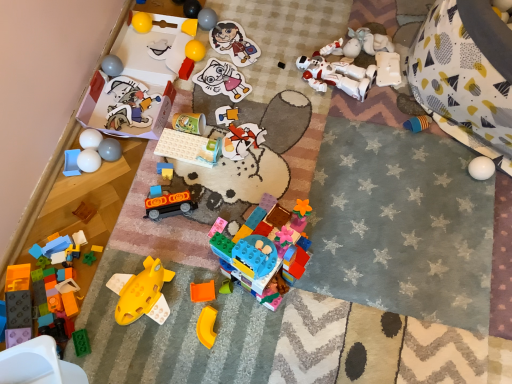
At what (x,y) coordinates should I click in order to perform the action: click on vacant space behind matte plastic blocks at center, which appears as the fifteenth toy when viewed from the right. Please return your answer as a coordinate pair (x, y). Looking at the image, I should click on (176, 132).